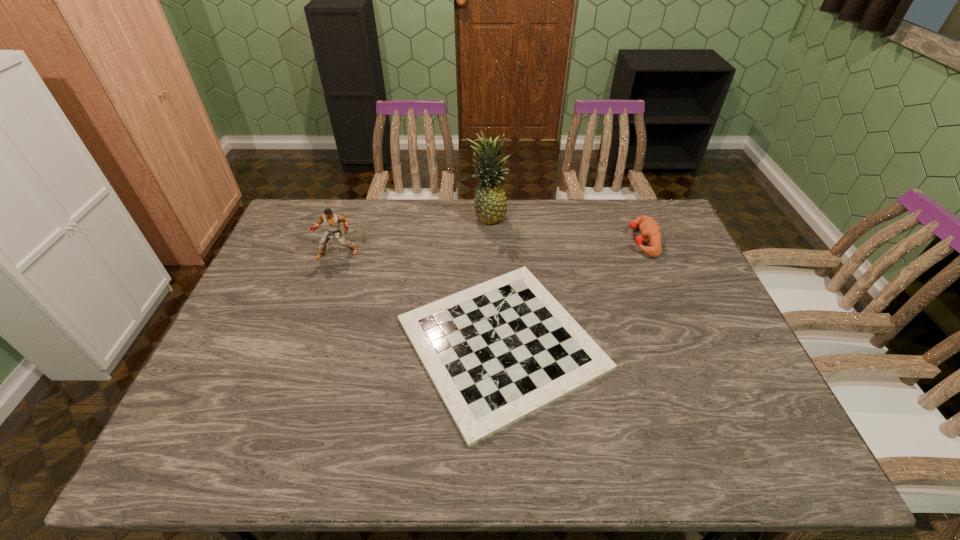
Find the location of a particular element. The width and height of the screenshot is (960, 540). empty space between the third shortest object and the nearest object is located at coordinates pyautogui.click(x=420, y=299).

This screenshot has height=540, width=960. What are the coordinates of `free space between the nearest object and the third tallest object` in the screenshot? It's located at [572, 292].

Point out which object is positioned as the third nearest to the taller puncher. Please provide its 2D coordinates. Your answer should be formatted as a tuple, i.e. [(x, y)], where the tuple contains the x and y coordinates of a point satisfying the conditions above.

[(650, 231)]

Where is `object that is the second nearest to the taller puncher`? object that is the second nearest to the taller puncher is located at coordinates (490, 202).

The width and height of the screenshot is (960, 540). In order to click on blank area in the image that satisfies the following two spatial constraints: 1. on the front-facing side of the second tallest object; 2. on the right side of the shortest object in this screenshot , I will do `click(305, 343)`.

The image size is (960, 540). What are the coordinates of `free space that satisfies the following two spatial constraints: 1. with the gloves of the right puncher facing forward; 2. on the front-facing side of the left puncher` in the screenshot? It's located at (647, 254).

Locate an element on the screen. This screenshot has width=960, height=540. vacant point that satisfies the following two spatial constraints: 1. with the gloves of the rightmost object facing forward; 2. on the front-facing side of the second tallest object is located at coordinates (647, 254).

Where is `free space that satisfies the following two spatial constraints: 1. with the gloves of the shorter puncher facing forward; 2. on the front-facing side of the leftmost object`? free space that satisfies the following two spatial constraints: 1. with the gloves of the shorter puncher facing forward; 2. on the front-facing side of the leftmost object is located at coordinates (647, 254).